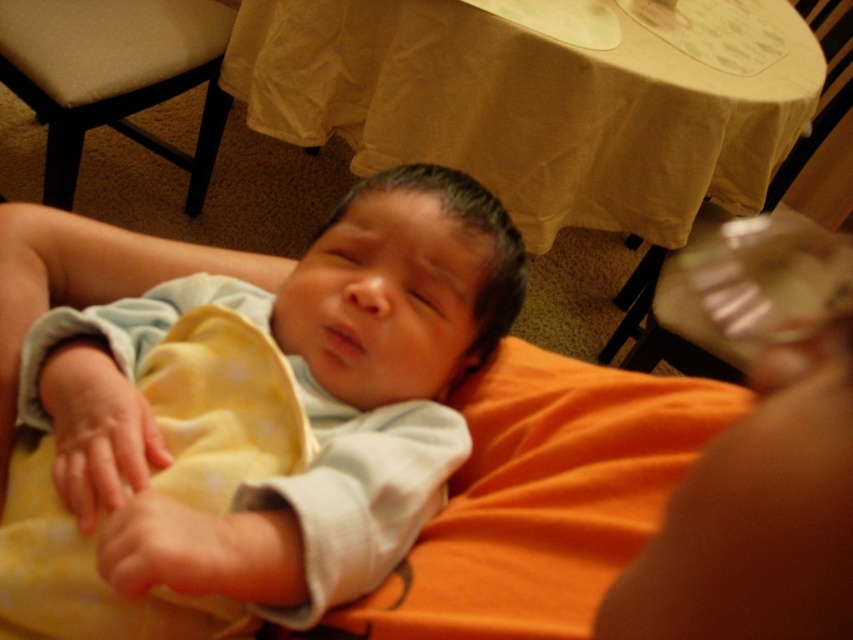
You are a photographer trying to capture the baby in the scene. The baby is on a beige fabric chair at upper left. To ensure the baby stays comfortable, you need to place a soft blanket on the chair. The blanket is 0.1 meters in width. The point representing the chair is at coordinates point (x=114, y=76). Can the blanket fit on the chair?

The beige fabric chair at upper left is represented by point (x=114, y=76). The blanket is 0.1 meters wide, but the chair has no specified dimensions. Therefore, it is uncertain if the blanket will fit.

You are a parent holding a baby and want to place a cloth under them for comfort. You have two options, the soft yellow cloth at lower left and the smooth yellow cloth at lower left. Which cloth is closer to you when you look down at the baby?

The soft yellow cloth at lower left is closer to you because it is further to the viewer than the smooth yellow cloth at lower left.